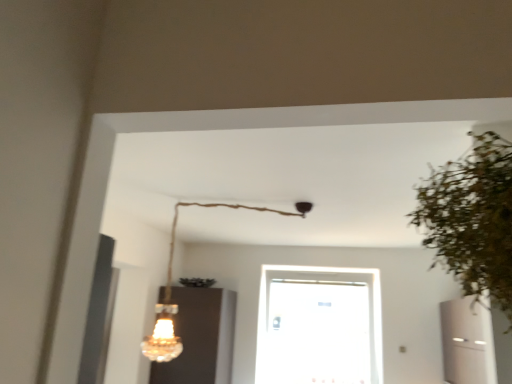
Question: Is green leafy plant at right positioned far away from matte glass cabinet at lower left?

Choices:
 (A) yes
 (B) no

Answer: (A)

Question: From a real-world perspective, is green leafy plant at right located higher than matte glass cabinet at lower left?

Choices:
 (A) no
 (B) yes

Answer: (B)

Question: Considering the relative sizes of green leafy plant at right and matte glass cabinet at lower left in the image provided, is green leafy plant at right smaller than matte glass cabinet at lower left?

Choices:
 (A) no
 (B) yes

Answer: (B)

Question: Does green leafy plant at right turn towards matte glass cabinet at lower left?

Choices:
 (A) no
 (B) yes

Answer: (A)

Question: Is green leafy plant at right in front of matte glass cabinet at lower left?

Choices:
 (A) yes
 (B) no

Answer: (A)

Question: From the image's perspective, relative to matte glass cabinet at lower left, is white glossy air conditioner at right above or below?

Choices:
 (A) below
 (B) above

Answer: (B)

Question: In terms of width, does white glossy air conditioner at right look wider or thinner when compared to matte glass cabinet at lower left?

Choices:
 (A) wide
 (B) thin

Answer: (B)

Question: Based on their sizes in the image, would you say white glossy air conditioner at right is bigger or smaller than matte glass cabinet at lower left?

Choices:
 (A) big
 (B) small

Answer: (B)

Question: In the image, is white glossy air conditioner at right on the left side or the right side of matte glass cabinet at lower left?

Choices:
 (A) left
 (B) right

Answer: (B)

Question: Is transparent glass door at center bigger or smaller than matte glass cabinet at lower left?

Choices:
 (A) big
 (B) small

Answer: (B)

Question: From the image's perspective, is transparent glass door at center located above or below matte glass cabinet at lower left?

Choices:
 (A) below
 (B) above

Answer: (B)

Question: Is point (338, 367) closer or farther from the camera than point (187, 289)?

Choices:
 (A) farther
 (B) closer

Answer: (A)

Question: Relative to matte glass cabinet at lower left, is transparent glass door at center in front or behind?

Choices:
 (A) front
 (B) behind

Answer: (B)

Question: Is transparent glass door at center situated inside crystal glass chandelier at upper center or outside?

Choices:
 (A) inside
 (B) outside

Answer: (B)

Question: Considering the positions of transparent glass door at center and crystal glass chandelier at upper center in the image, is transparent glass door at center wider or thinner than crystal glass chandelier at upper center?

Choices:
 (A) thin
 (B) wide

Answer: (A)